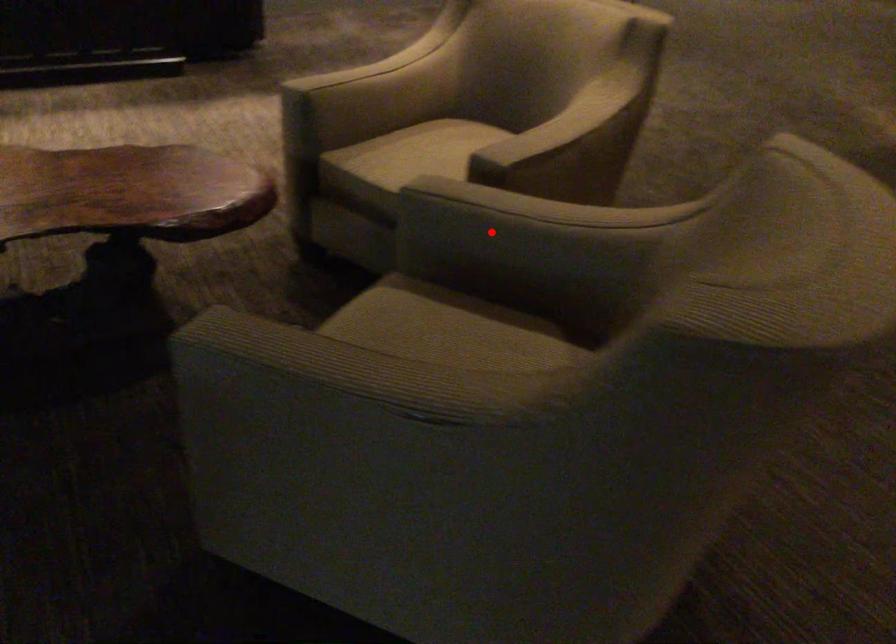
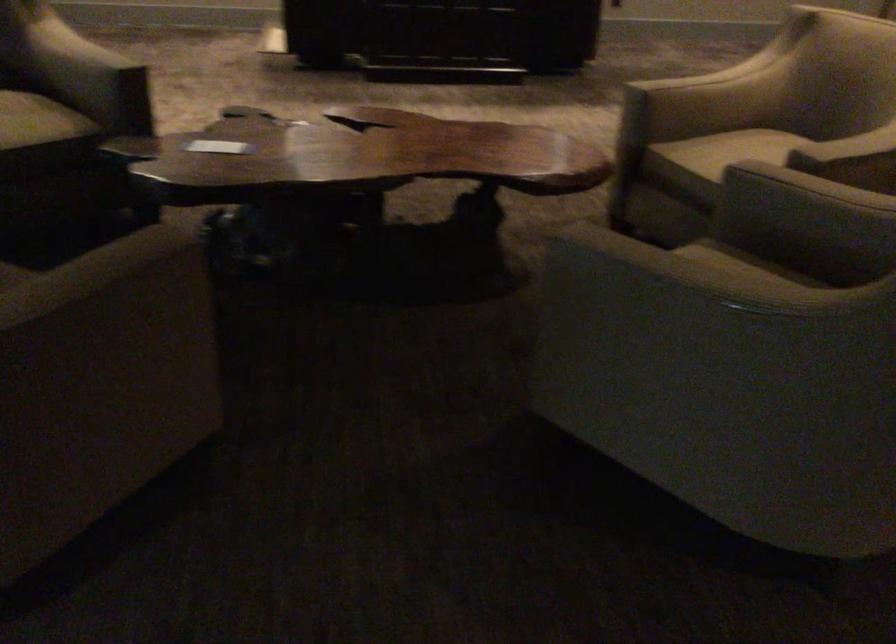
Where in the second image is the point corresponding to the highlighted location from the first image?

(806, 207)